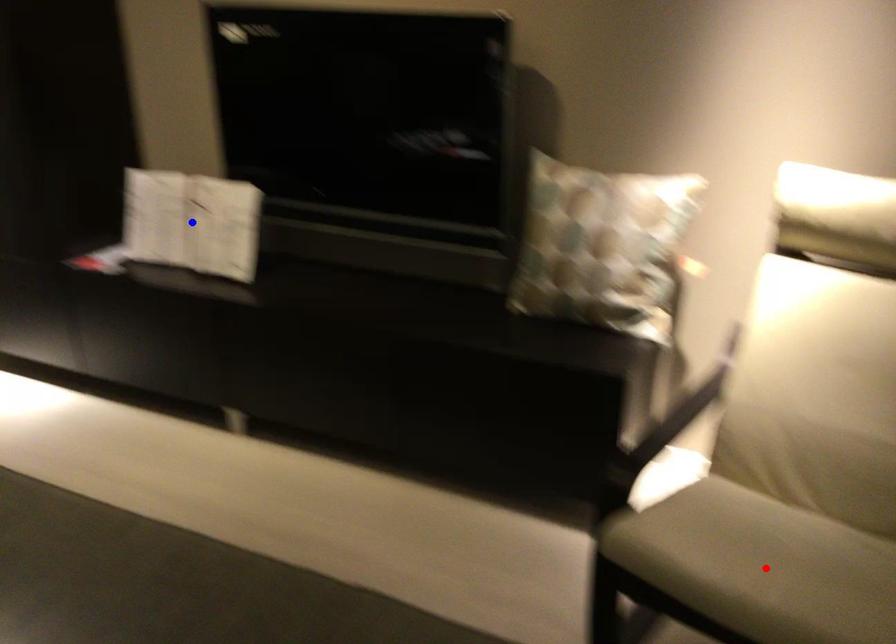
Question: Two points are marked on the image. Which point is closer to the camera?

Choices:
 (A) Blue point is closer.
 (B) Red point is closer.

Answer: (B)